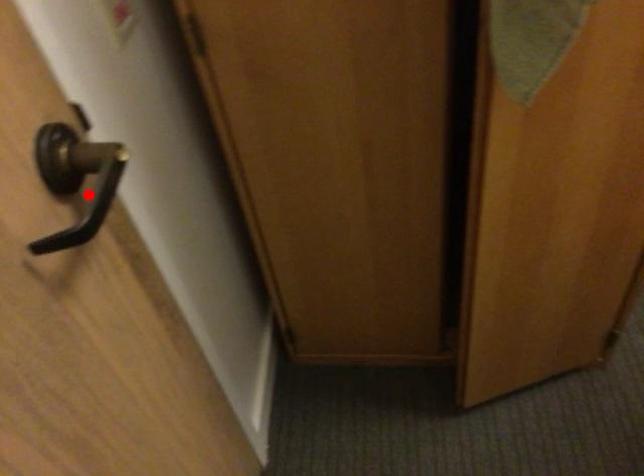
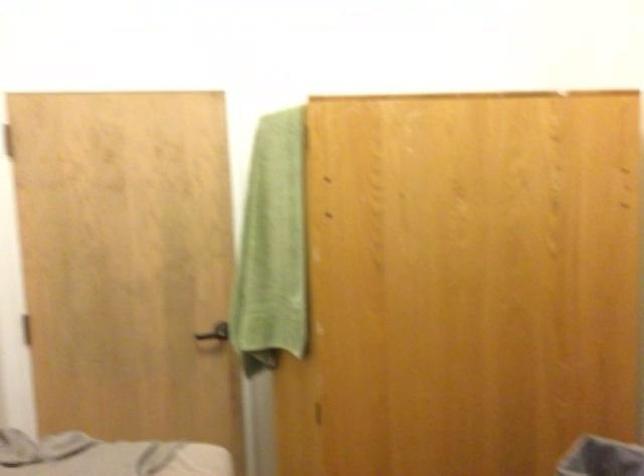
Question: I am providing you with two images of the same scene from different viewpoints. A red point is marked on the first image. At the location where the point appears in image 1, is it still visible in image 2?

Choices:
 (A) Yes
 (B) No

Answer: (B)